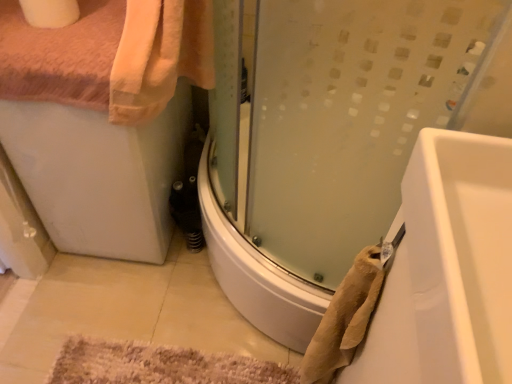
Describe the element at coordinates (50, 12) in the screenshot. I see `white matte toilet paper at upper left` at that location.

This screenshot has height=384, width=512. What do you see at coordinates (159, 365) in the screenshot? I see `beige textured bath mat at lower center` at bounding box center [159, 365].

Image resolution: width=512 pixels, height=384 pixels. In order to click on white matte toilet paper at upper left in this screenshot , I will do `click(50, 12)`.

Based on the photo, are white matte toilet paper at upper left and beige textured towel at lower right beside each other?

white matte toilet paper at upper left is not next to beige textured towel at lower right, and they're not touching.

This screenshot has width=512, height=384. In order to click on toilet paper above the beige textured towel at lower right (from the image's perspective) in this screenshot , I will do `click(50, 12)`.

From a real-world perspective, who is located lower, white matte toilet paper at upper left or beige textured towel at lower right?

beige textured towel at lower right is physically lower.

Which is correct: white matte toilet paper at upper left is inside beige textured towel at lower right, or outside of it?

white matte toilet paper at upper left exists outside the volume of beige textured towel at lower right.

From the image's perspective, is beige textured bath mat at lower center on top of white matte toilet paper at upper left?

No.

Between beige textured bath mat at lower center and white matte toilet paper at upper left, which one has less height?

beige textured bath mat at lower center.

From a real-world perspective, which object stands above the other?

white matte toilet paper at upper left, from a real-world perspective.

What are the coordinates of `toilet paper that is on the left side of beige textured bath mat at lower center` in the screenshot? It's located at (50, 12).

Are white glossy bathtub at lower right and beige textured towel at lower right far apart?

Actually, white glossy bathtub at lower right and beige textured towel at lower right are a little close together.

Between white glossy bathtub at lower right and beige textured towel at lower right, which one appears on the left side from the viewer's perspective?

beige textured towel at lower right.

Is point (426, 179) behind point (320, 329)?

No, it is in front of (320, 329).

Is beige textured towel at lower right inside or outside of white glossy bathtub at lower right?

beige textured towel at lower right is not inside white glossy bathtub at lower right, it's outside.

How distant is beige textured towel at lower right from white glossy bathtub at lower right?

5.28 inches.

Does beige textured towel at lower right have a smaller size compared to white glossy bathtub at lower right?

Yes.

Can you see beige textured towel at lower right touching white glossy bathtub at lower right?

→ No, beige textured towel at lower right is not next to white glossy bathtub at lower right.

Which is in front, point (315, 187) or point (480, 146)?

The point (480, 146) is in front.

From the image's perspective, does satin glass shower door at center appear lower than white glossy bathtub at lower right?

No, from the image's perspective, satin glass shower door at center is not beneath white glossy bathtub at lower right.

At what (x,y) coordinates should I click in order to perform the action: click on bathtub in front of the satin glass shower door at center. Please return your answer as a coordinate pair (x, y). This screenshot has height=384, width=512. Looking at the image, I should click on (447, 269).

Who is taller, satin glass shower door at center or white glossy bathtub at lower right?

With more height is white glossy bathtub at lower right.

Is satin glass shower door at center taller than beige textured towel at lower right?

Yes.

Is satin glass shower door at center aimed at beige textured towel at lower right?

Yes, satin glass shower door at center is turned towards beige textured towel at lower right.

Is point (377, 93) farther from camera compared to point (351, 315)?

No, (377, 93) is in front of (351, 315).

Considering the positions of objects beige textured bath mat at lower center and white glossy bathtub at lower right in the image provided, who is more to the right, beige textured bath mat at lower center or white glossy bathtub at lower right?

From the viewer's perspective, white glossy bathtub at lower right appears more on the right side.

Is the depth of beige textured bath mat at lower center less than that of white glossy bathtub at lower right?

No, beige textured bath mat at lower center is further to the viewer.

Looking at their sizes, would you say beige textured bath mat at lower center is wider or thinner than white glossy bathtub at lower right?

Clearly, beige textured bath mat at lower center has more width compared to white glossy bathtub at lower right.

Is beige textured bath mat at lower center in contact with white glossy bathtub at lower right?

beige textured bath mat at lower center and white glossy bathtub at lower right are not in contact.

I want to click on bath towel that appears in front of the white matte toilet paper at upper left, so click(x=345, y=318).

At what (x,y) coordinates should I click in order to perform the action: click on bath mat on the right of white matte toilet paper at upper left. Please return your answer as a coordinate pair (x, y). The width and height of the screenshot is (512, 384). Looking at the image, I should click on coord(159,365).

Considering their positions, is beige textured bath mat at lower center positioned further to beige textured towel at lower right than satin glass shower door at center?

beige textured bath mat at lower center is positioned further to the anchor beige textured towel at lower right.

Which object lies further to the anchor point white glossy bathtub at lower right, beige textured bath mat at lower center or white matte toilet paper at upper left?

white matte toilet paper at upper left lies further to white glossy bathtub at lower right than the other object.

Looking at the image, which one is located closer to white matte toilet paper at upper left, satin glass shower door at center or beige textured bath mat at lower center?

satin glass shower door at center.

Considering their positions, is beige textured towel at lower right positioned closer to satin glass shower door at center than white matte toilet paper at upper left?

The object closer to satin glass shower door at center is beige textured towel at lower right.

From the image, which object appears to be farther from beige textured towel at lower right, white matte toilet paper at upper left or white glossy bathtub at lower right?

white matte toilet paper at upper left lies further to beige textured towel at lower right than the other object.

From the image, which object appears to be farther from beige textured bath mat at lower center, satin glass shower door at center or white glossy bathtub at lower right?

Based on the image, white glossy bathtub at lower right appears to be further to beige textured bath mat at lower center.

Considering their positions, is beige textured bath mat at lower center positioned further to beige textured towel at lower right than white matte toilet paper at upper left?

white matte toilet paper at upper left is further to beige textured towel at lower right.

Estimate the real-world distances between objects in this image. Which object is further from white glossy bathtub at lower right, white matte toilet paper at upper left or satin glass shower door at center?

The object further to white glossy bathtub at lower right is white matte toilet paper at upper left.

Image resolution: width=512 pixels, height=384 pixels. Find the location of `bath towel between white matte toilet paper at upper left and white glossy bathtub at lower right in the vertical direction`. bath towel between white matte toilet paper at upper left and white glossy bathtub at lower right in the vertical direction is located at coordinates (345, 318).

Identify the location of shower door between white matte toilet paper at upper left and white glossy bathtub at lower right from top to bottom. (333, 135).

I want to click on bath towel that lies between white matte toilet paper at upper left and beige textured bath mat at lower center from top to bottom, so click(x=345, y=318).

At what (x,y) coordinates should I click in order to perform the action: click on bath towel between satin glass shower door at center and white glossy bathtub at lower right from top to bottom. Please return your answer as a coordinate pair (x, y). Looking at the image, I should click on (345, 318).